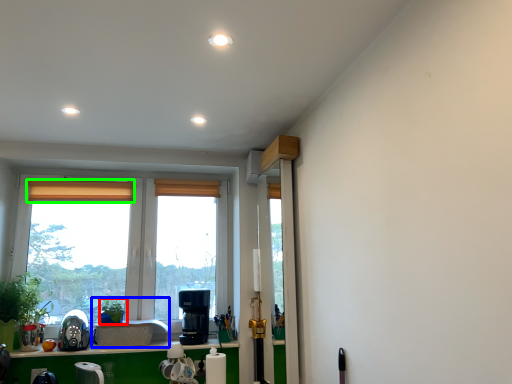
Question: Considering the real-world distances, which object is closest to plant (highlighted by a red box)? sink (highlighted by a blue box) or curtain (highlighted by a green box).

Choices:
 (A) sink
 (B) curtain

Answer: (A)